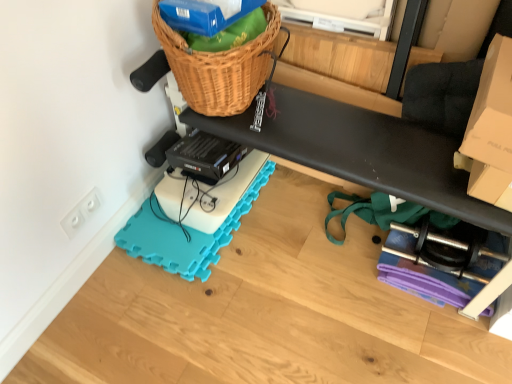
This screenshot has width=512, height=384. In order to click on free space above black rubber exercise mat at lower center (from a real-world perspective) in this screenshot , I will do `click(279, 294)`.